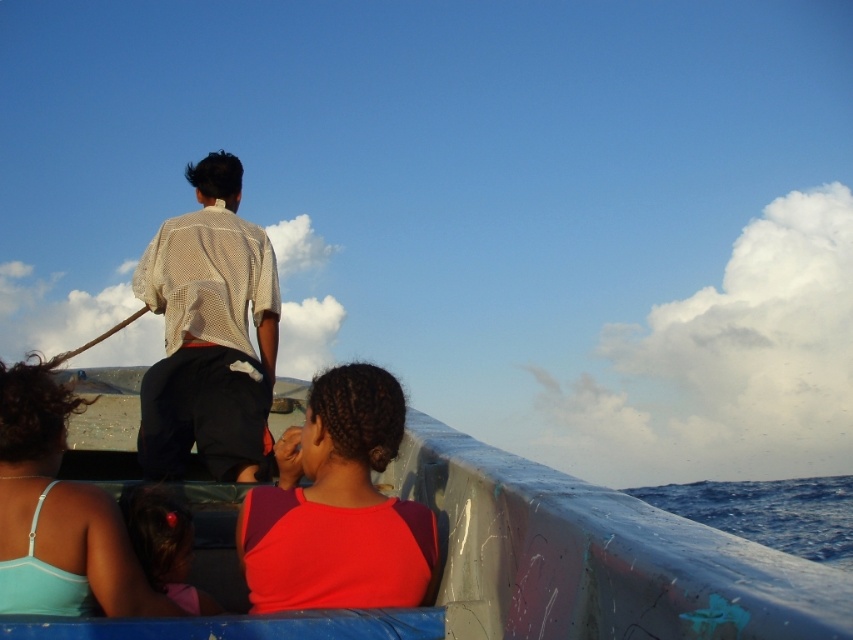
Question: Is matte red shirt at center closer to the viewer compared to light blue fabric top at lower left?

Choices:
 (A) yes
 (B) no

Answer: (B)

Question: In this image, where is blue painted wood boat at center located relative to blue water at lower right?

Choices:
 (A) left
 (B) right

Answer: (A)

Question: Which object is closer to the camera taking this photo?

Choices:
 (A) blue water at lower right
 (B) light blue fabric top at lower left
 (C) light beige mesh shirt at upper left

Answer: (B)

Question: Is blue water at lower right to the left of pink fabric hairband at lower left from the viewer's perspective?

Choices:
 (A) no
 (B) yes

Answer: (A)

Question: Which of the following is the farthest from the observer?

Choices:
 (A) matte red shirt at center
 (B) light blue fabric top at lower left
 (C) blue painted wood boat at center
 (D) pink fabric hairband at lower left

Answer: (D)

Question: Among these objects, which one is farthest from the camera?

Choices:
 (A) matte red shirt at center
 (B) pink fabric hairband at lower left

Answer: (B)